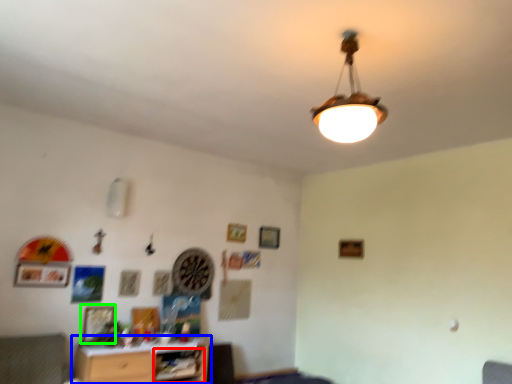
Question: Which object is the closest to the shelf (highlighted by a red box)? Choose among these: table (highlighted by a blue box) or picture frame (highlighted by a green box).

Choices:
 (A) table
 (B) picture frame

Answer: (A)